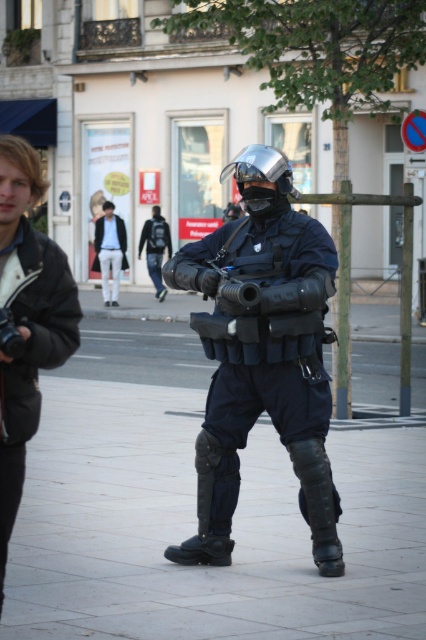
You are a pedestrian on the city street and want to cross to the other side. There is a black leather jacket at left and a dark blue uniform at center. Which direction should you look first to avoid them?

The black leather jacket at left is located below the dark blue uniform at center. Since the dark blue uniform at center is higher up, you should look towards the center first to avoid both individuals.

You are a drone operator trying to capture a clear image of two specific points on the city street scene. The points are labeled as point (x=60, y=307) and point (x=152, y=262). Since you can only focus on one point at a time, which point should you choose to ensure it appears larger in your drone camera view?

Point (x=60, y=307) is closer to the camera than point (x=152, y=262), so it will appear larger in the drone camera view.